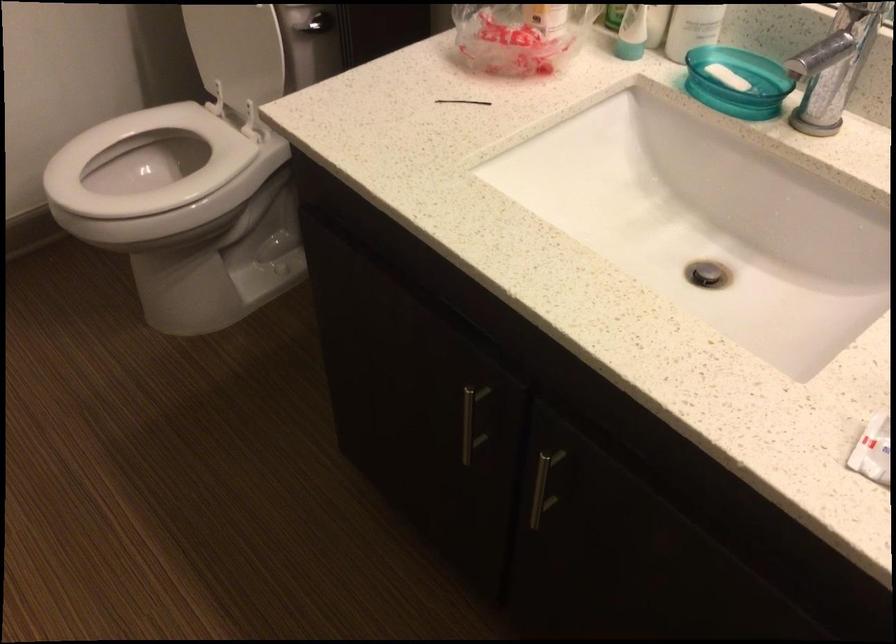
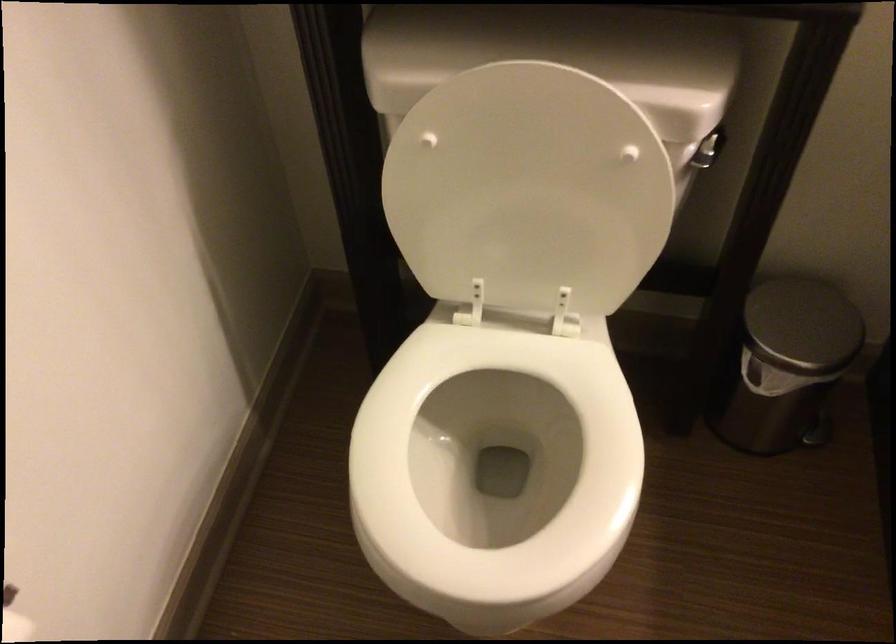
The point at (208, 223) is marked in the first image. Where is the corresponding point in the second image?

(494, 468)